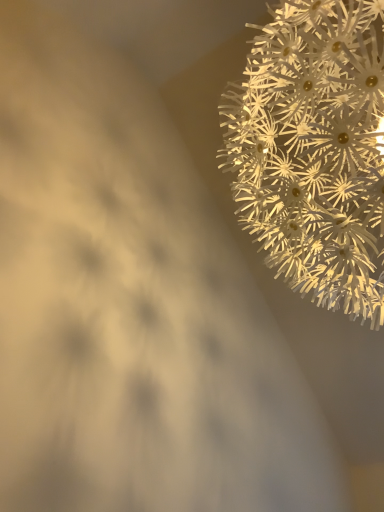
Identify the location of ivory textured chandelier at upper right. (313, 150).

The width and height of the screenshot is (384, 512). What do you see at coordinates (313, 150) in the screenshot?
I see `ivory textured chandelier at upper right` at bounding box center [313, 150].

Measure the distance between ivory textured chandelier at upper right and camera.

ivory textured chandelier at upper right and camera are 26.93 inches apart from each other.

Locate an element on the screen. The width and height of the screenshot is (384, 512). ivory textured chandelier at upper right is located at coordinates (313, 150).